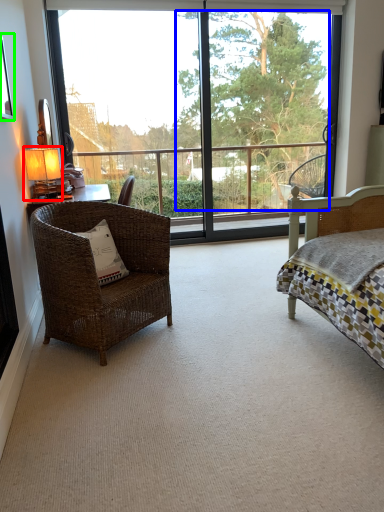
Question: Which object is positioned farthest from table lamp (highlighted by a red box)? Select from tree (highlighted by a blue box) and picture frame (highlighted by a green box).

Choices:
 (A) tree
 (B) picture frame

Answer: (A)